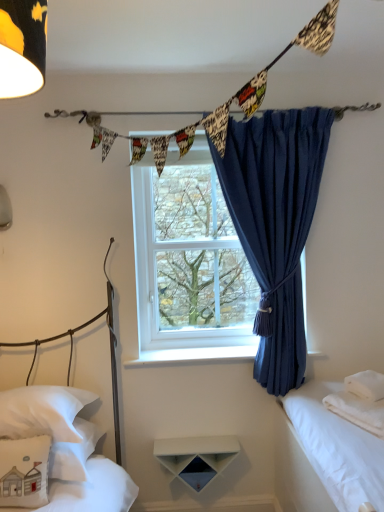
Locate an element on the screen. vacant space situated on the left part of white soft pillow at right, which is the first pillow in right-to-left order is located at coordinates (334, 392).